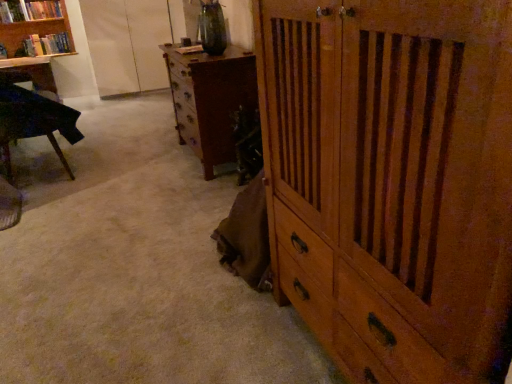
Question: Should I look upward or downward to see matte black desk at left?

Choices:
 (A) down
 (B) up

Answer: (B)

Question: From a real-world perspective, does wooden bookshelf at upper left stand above matte black desk at left?

Choices:
 (A) yes
 (B) no

Answer: (A)

Question: Is there a large distance between wooden bookshelf at upper left and matte black desk at left?

Choices:
 (A) yes
 (B) no

Answer: (B)

Question: Can matte black desk at left be found inside wooden bookshelf at upper left?

Choices:
 (A) yes
 (B) no

Answer: (B)

Question: From a real-world perspective, is wooden bookshelf at upper left located beneath matte black desk at left?

Choices:
 (A) no
 (B) yes

Answer: (A)

Question: Is wooden bookshelf at upper left facing away from matte black desk at left?

Choices:
 (A) no
 (B) yes

Answer: (A)

Question: Is wooden bookshelf at upper left next to matte black desk at left and touching it?

Choices:
 (A) no
 (B) yes

Answer: (A)

Question: Does wooden cabinet at center, marked as the second chest of drawers in a left-to-right arrangement, contain hardcover book at upper left, which is the second book from top to bottom?

Choices:
 (A) no
 (B) yes

Answer: (A)

Question: Considering the relative positions of wooden cabinet at center, which is the first chest of drawers in front-to-back order, and hardcover book at upper left, which is the second book from top to bottom, in the image provided, is wooden cabinet at center, which is the first chest of drawers in front-to-back order, in front of hardcover book at upper left, which is the second book from top to bottom,?

Choices:
 (A) no
 (B) yes

Answer: (B)

Question: Considering the relative sizes of wooden cabinet at center, positioned as the first chest of drawers in right-to-left order, and hardcover book at upper left, the 1th book when ordered from bottom to top, in the image provided, is wooden cabinet at center, positioned as the first chest of drawers in right-to-left order, shorter than hardcover book at upper left, the 1th book when ordered from bottom to top,?

Choices:
 (A) no
 (B) yes

Answer: (A)

Question: Is wooden cabinet at center, the 2th chest of drawers in the back-to-front sequence, to the right of hardcover book at upper left, which is the second book from top to bottom, from the viewer's perspective?

Choices:
 (A) no
 (B) yes

Answer: (B)

Question: Is wooden cabinet at center, marked as the second chest of drawers in a left-to-right arrangement, bigger than hardcover book at upper left, the 1th book when ordered from bottom to top?

Choices:
 (A) no
 (B) yes

Answer: (B)

Question: Is wooden cabinet at center, the 2th chest of drawers in the back-to-front sequence, aimed at hardcover book at upper left, which is the second book from top to bottom?

Choices:
 (A) yes
 (B) no

Answer: (B)

Question: From a real-world perspective, is wooden bookshelf at upper left positioned under wooden cabinet at center, positioned as the first chest of drawers in right-to-left order, based on gravity?

Choices:
 (A) yes
 (B) no

Answer: (B)